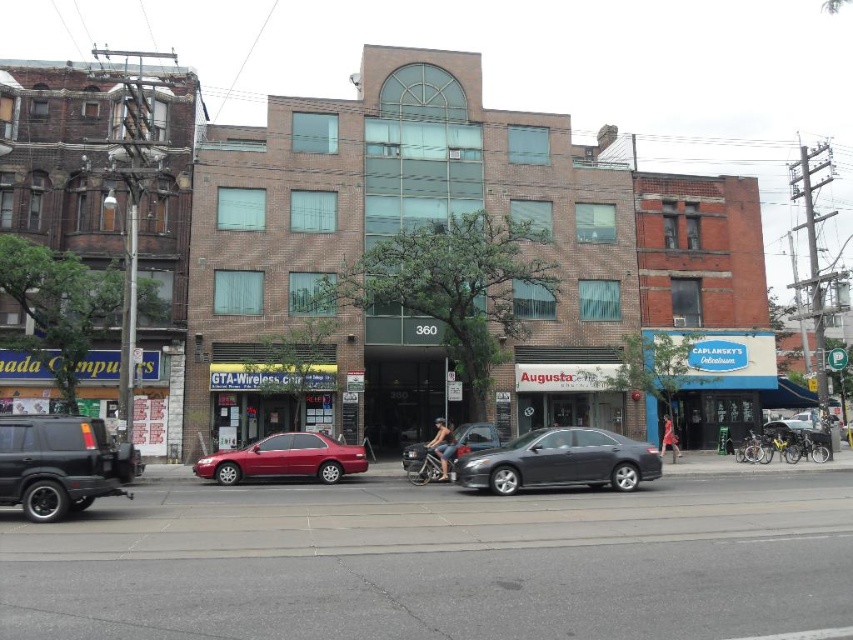
Is black matte suv at lower left in front of glossy red sedan at center?

Yes, it is.

Is point (12, 416) positioned in front of point (338, 444)?

Yes, it is in front of point (338, 444).

Identify the location of black matte suv at lower left. (59, 465).

Is satin black sedan at center to the right of metallic silver car at center from the viewer's perspective?

Indeed, satin black sedan at center is positioned on the right side of metallic silver car at center.

Locate an element on the screen. satin black sedan at center is located at coordinates (560, 461).

Find the location of `satin black sedan at center`. satin black sedan at center is located at coordinates (560, 461).

Is point (234, 452) positioned before point (461, 438)?

That is True.

You are a GUI agent. You are given a task and a screenshot of the screen. Output one action in this format:
    pyautogui.click(x=<x>, y=<y>)
    Task: Click on the glossy red sedan at center
    This screenshot has width=853, height=640.
    Given the screenshot: What is the action you would take?
    pyautogui.click(x=283, y=460)

Find the location of a particular element. The width and height of the screenshot is (853, 640). glossy red sedan at center is located at coordinates (283, 460).